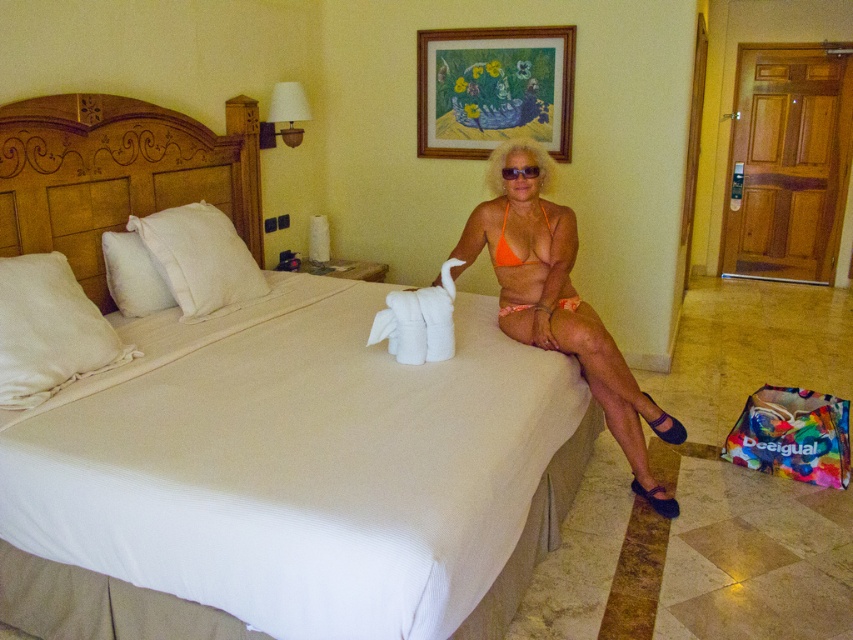
You are a hotel guest who wants to place the orange matte bikini at center on top of the white soft pillow at left. Will the bikini fit entirely on the pillow?

The white soft pillow at left is wider than the orange matte bikini at center, so the bikini will fit entirely on the pillow.